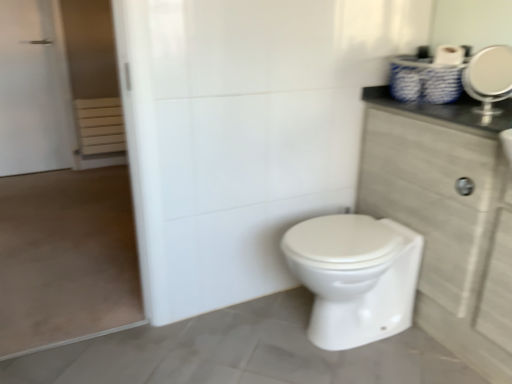
From the picture: What is the approximate height of white glossy toilet at center?

white glossy toilet at center is 18.08 inches in height.

Describe the element at coordinates (489, 77) in the screenshot. I see `silver metallic mirror at upper right` at that location.

The width and height of the screenshot is (512, 384). What do you see at coordinates (438, 210) in the screenshot?
I see `wooden cabinet at right` at bounding box center [438, 210].

Locate an element on the screen. Image resolution: width=512 pixels, height=384 pixels. white glossy toilet at center is located at coordinates tap(355, 277).

Which object is thinner, wooden cabinet at right or white glossy toilet at center?

With smaller width is wooden cabinet at right.

Based on the photo, is wooden cabinet at right aimed at white glossy toilet at center?

Yes, wooden cabinet at right is facing white glossy toilet at center.

How different are the orientations of wooden cabinet at right and white glossy toilet at center in degrees?

They differ by 0.204 degrees in their facing directions.

Measure the distance between wooden cabinet at right and white glossy toilet at center.

wooden cabinet at right and white glossy toilet at center are 10.71 inches apart from each other.

From the image's perspective, would you say white matte screen door at left is positioned over white glossy toilet at center?

Indeed, from the image's perspective, white matte screen door at left is shown above white glossy toilet at center.

Is white matte screen door at left completely or partially outside of white glossy toilet at center?

Yes.

Where is `mirror above the white matte screen door at left (from the image's perspective)`? This screenshot has width=512, height=384. mirror above the white matte screen door at left (from the image's perspective) is located at coordinates (489, 77).

Which of these two, silver metallic mirror at upper right or white matte screen door at left, stands shorter?

Standing shorter between the two is silver metallic mirror at upper right.

From a real-world perspective, is wooden cabinet at right on top of white matte screen door at left?

No, from a real-world perspective, wooden cabinet at right is not over white matte screen door at left

Could white matte screen door at left be considered to be inside wooden cabinet at right?

No, white matte screen door at left is not a part of wooden cabinet at right.

Which object is further away from the camera, wooden cabinet at right or white matte screen door at left?

white matte screen door at left is further from the camera.

Who is more distant, silver metallic mirror at upper right or wooden cabinet at right?

silver metallic mirror at upper right is further away from the camera.

Considering the sizes of objects silver metallic mirror at upper right and wooden cabinet at right in the image provided, who is bigger, silver metallic mirror at upper right or wooden cabinet at right?

wooden cabinet at right.

Between silver metallic mirror at upper right and wooden cabinet at right, which one appears on the left side from the viewer's perspective?

wooden cabinet at right.

Based on the photo, from a real-world perspective, is silver metallic mirror at upper right above or below wooden cabinet at right?

silver metallic mirror at upper right is situated higher than wooden cabinet at right in the real world.

Considering the sizes of wooden cabinet at right and silver metallic mirror at upper right in the image, is wooden cabinet at right bigger or smaller than silver metallic mirror at upper right?

In the image, wooden cabinet at right appears to be larger than silver metallic mirror at upper right.

Looking at their sizes, would you say wooden cabinet at right is wider or thinner than silver metallic mirror at upper right?

wooden cabinet at right is wider than silver metallic mirror at upper right.

Considering the positions of objects wooden cabinet at right and silver metallic mirror at upper right in the image provided, who is more to the left, wooden cabinet at right or silver metallic mirror at upper right?

wooden cabinet at right is more to the left.

This screenshot has width=512, height=384. In order to click on dresser located below the silver metallic mirror at upper right (from the image's perspective) in this screenshot , I will do `click(438, 210)`.

Is white glossy toilet at center with silver metallic mirror at upper right?

No, white glossy toilet at center is not in contact with silver metallic mirror at upper right.

Based on their sizes in the image, would you say white glossy toilet at center is bigger or smaller than silver metallic mirror at upper right?

Considering their sizes, white glossy toilet at center takes up more space than silver metallic mirror at upper right.

At what (x,y) coordinates should I click in order to perform the action: click on mirror located above the white glossy toilet at center (from a real-world perspective). Please return your answer as a coordinate pair (x, y). Looking at the image, I should click on (489, 77).

You are a GUI agent. You are given a task and a screenshot of the screen. Output one action in this format:
    pyautogui.click(x=<x>, y=<y>)
    Task: Click on the dresser that is above the white glossy toilet at center (from a real-world perspective)
    
    Given the screenshot: What is the action you would take?
    pyautogui.click(x=438, y=210)

Find the location of `screen door lying on the left of white glossy toilet at center`. screen door lying on the left of white glossy toilet at center is located at coordinates (63, 179).

Consider the image. Based on their spatial positions, is wooden cabinet at right or silver metallic mirror at upper right closer to white glossy toilet at center?

The object closer to white glossy toilet at center is wooden cabinet at right.

Looking at this image, from the image, which object appears to be nearer to silver metallic mirror at upper right, white glossy toilet at center or wooden cabinet at right?

Among the two, wooden cabinet at right is located nearer to silver metallic mirror at upper right.

Considering their positions, is wooden cabinet at right positioned closer to white matte screen door at left than silver metallic mirror at upper right?

wooden cabinet at right lies closer to white matte screen door at left than the other object.

From the image, which object appears to be farther from white matte screen door at left, white glossy toilet at center or wooden cabinet at right?

The object further to white matte screen door at left is wooden cabinet at right.

Which object lies further to the anchor point white matte screen door at left, wooden cabinet at right or white glossy toilet at center?

wooden cabinet at right is further to white matte screen door at left.

Considering their positions, is wooden cabinet at right positioned further to silver metallic mirror at upper right than white glossy toilet at center?

The object further to silver metallic mirror at upper right is white glossy toilet at center.

Looking at the image, which one is located closer to wooden cabinet at right, white glossy toilet at center or silver metallic mirror at upper right?

white glossy toilet at center is positioned closer to the anchor wooden cabinet at right.

When comparing their distances from silver metallic mirror at upper right, does white matte screen door at left or wooden cabinet at right seem closer?

Among the two, wooden cabinet at right is located nearer to silver metallic mirror at upper right.

Identify the location of dresser between white matte screen door at left and silver metallic mirror at upper right from left to right. This screenshot has width=512, height=384. (438, 210).

Find the location of a particular element. bidet located between white matte screen door at left and wooden cabinet at right in the left-right direction is located at coordinates (355, 277).

Locate an element on the screen. dresser between silver metallic mirror at upper right and white glossy toilet at center in the vertical direction is located at coordinates (438, 210).

Locate an element on the screen. The image size is (512, 384). bidet located between white matte screen door at left and silver metallic mirror at upper right in the left-right direction is located at coordinates (355, 277).